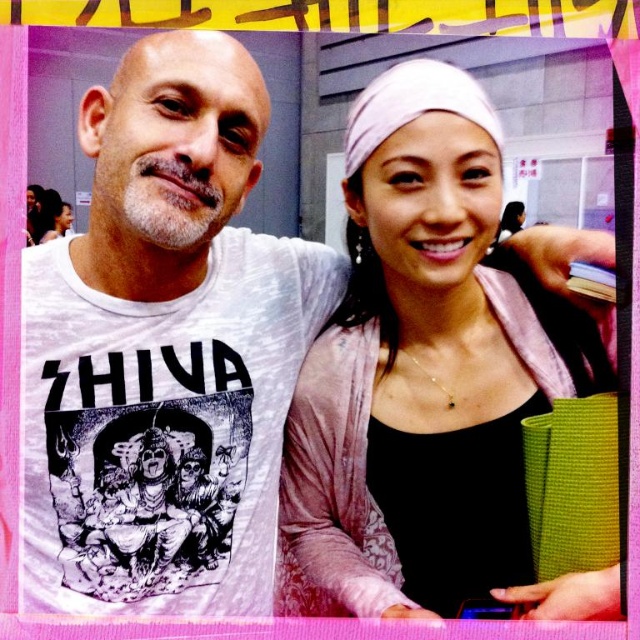
You are a photographer adjusting your camera to focus on two specific points in the image. The first point is at coordinates point (x=228, y=259) and the second point is at point (x=515, y=358). Which point is closer to the camera lens?

Point (x=228, y=259) is closer to the camera lens because it is further to the viewer than point (x=515, y=358).